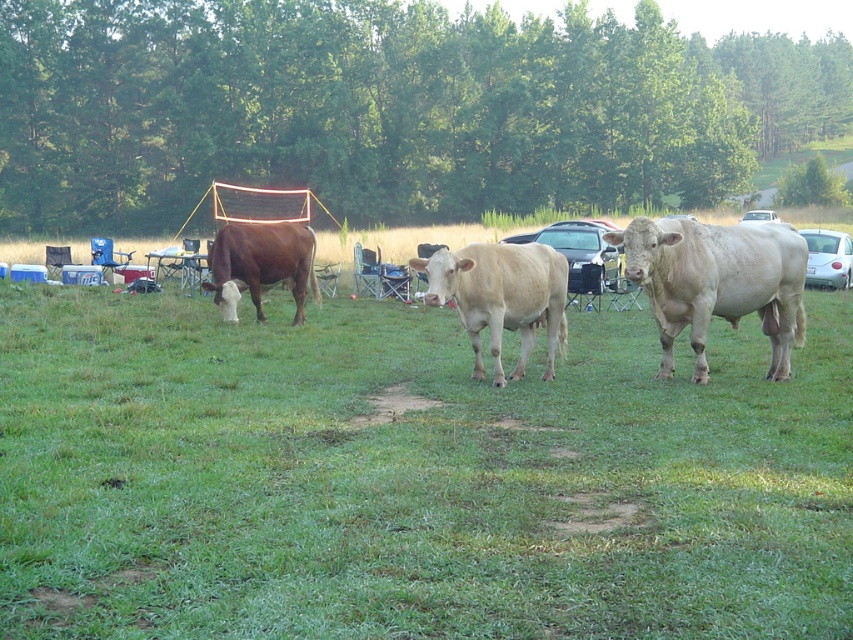
Question: Considering the real-world distances, which object is closest to the light beige smooth cow at center?

Choices:
 (A) brown matte cow at center
 (B) white smooth bull at right

Answer: (B)

Question: In this image, where is white smooth bull at right located relative to white glossy car at center?

Choices:
 (A) above
 (B) below

Answer: (B)

Question: Which point is farther to the camera?

Choices:
 (A) white glossy car at center
 (B) light beige smooth cow at center
 (C) white smooth bull at right

Answer: (A)

Question: Can you confirm if white smooth bull at right is positioned to the left of light beige smooth cow at center?

Choices:
 (A) no
 (B) yes

Answer: (A)

Question: In this image, where is light beige smooth cow at center located relative to white glossy car at right?

Choices:
 (A) left
 (B) right

Answer: (A)

Question: Which of the following is the farthest from the observer?

Choices:
 (A) (448, 253)
 (B) (306, 252)
 (C) (792, 282)

Answer: (B)